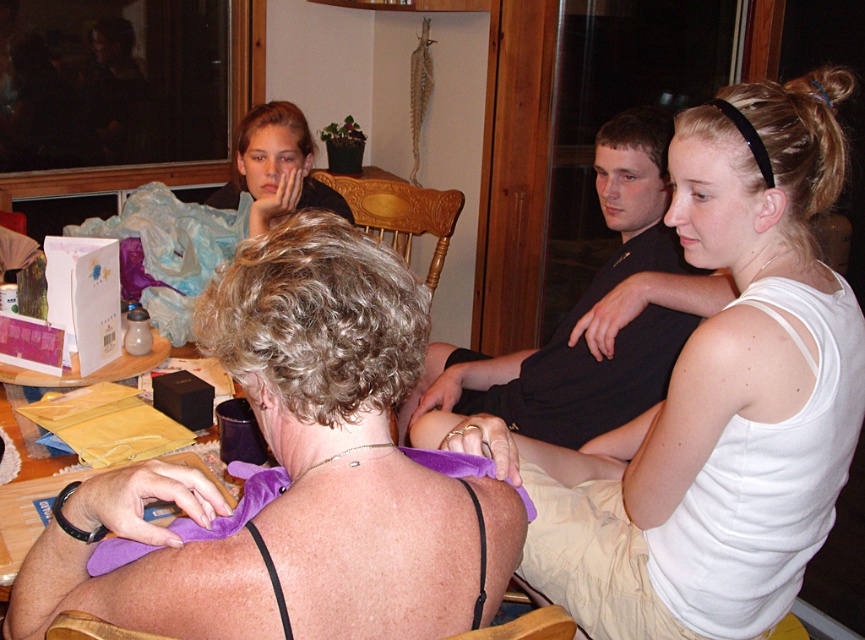
Question: Does white cotton tank top at upper right appear on the right side of matte black shirt at upper center?

Choices:
 (A) no
 (B) yes

Answer: (B)

Question: Estimate the real-world distances between objects in this image. Which object is farther from the matte black shirt at upper center?

Choices:
 (A) wooden table at center
 (B) purple fabric at upper center
 (C) black smooth shirt at upper right
 (D) white cotton tank top at upper right

Answer: (B)

Question: Is purple fabric at upper center thinner than matte black shirt at upper center?

Choices:
 (A) no
 (B) yes

Answer: (A)

Question: Does white cotton tank top at upper right appear under wooden table at center?

Choices:
 (A) yes
 (B) no

Answer: (B)

Question: Which is farther from the wooden table at center?

Choices:
 (A) matte black shirt at upper center
 (B) black smooth shirt at upper right
 (C) white cotton tank top at upper right
 (D) purple fabric at upper center

Answer: (C)

Question: Which point is closer to the camera?

Choices:
 (A) (372, 262)
 (B) (305, 198)

Answer: (A)